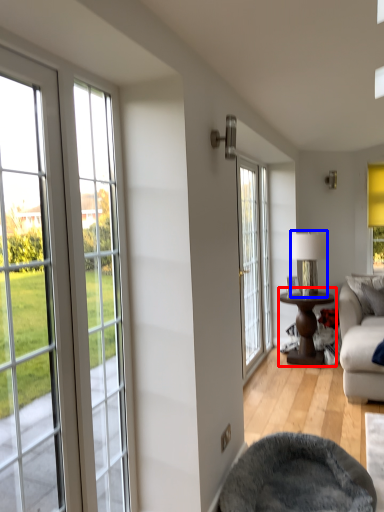
Question: Which object appears farthest to the camera in this image, table (highlighted by a red box) or lamp (highlighted by a blue box)?

Choices:
 (A) table
 (B) lamp

Answer: (B)